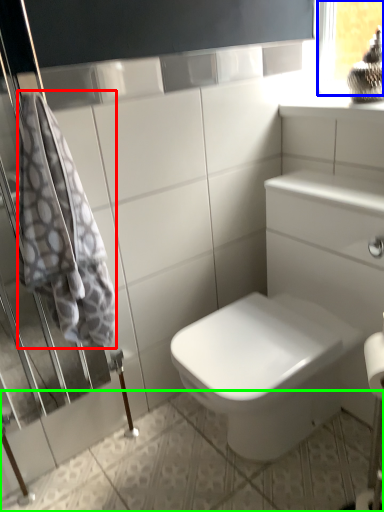
Question: Which object is positioned closest to bath towel (highlighted by a red box)? Select from window frame (highlighted by a blue box) and ceramic tile (highlighted by a green box).

Choices:
 (A) window frame
 (B) ceramic tile

Answer: (B)